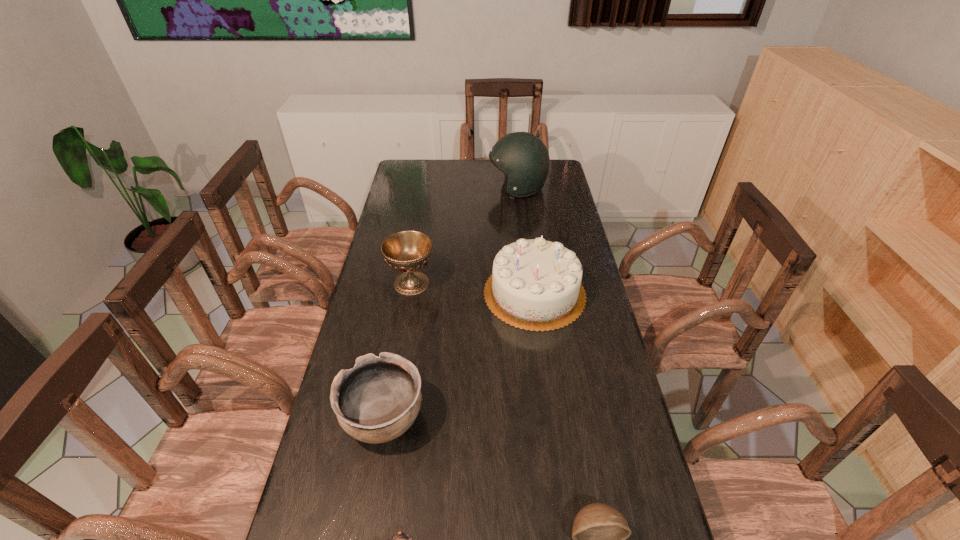
Locate an element on the screen. unoccupied area between the farthest object and the pottery is located at coordinates (451, 303).

The width and height of the screenshot is (960, 540). Find the location of `free space that is in between the pottery and the chalice`. free space that is in between the pottery and the chalice is located at coordinates (397, 351).

Image resolution: width=960 pixels, height=540 pixels. I want to click on free spot between the farthest object and the chalice, so click(465, 236).

This screenshot has height=540, width=960. I want to click on free spot between the birthday cake and the pottery, so click(459, 356).

In order to click on unoccupied area between the pottery and the chalice in this screenshot , I will do click(x=397, y=351).

Point out which object is positioned as the fourth nearest to the kitten. Please provide its 2D coordinates. Your answer should be formatted as a tuple, i.e. [(x, y)], where the tuple contains the x and y coordinates of a point satisfying the conditions above.

[(407, 251)]

Where is `object that stands as the fourth closest to the birthday cake`? The height and width of the screenshot is (540, 960). object that stands as the fourth closest to the birthday cake is located at coordinates (599, 533).

Locate an element on the screen. Image resolution: width=960 pixels, height=540 pixels. vacant region that satisfies the following two spatial constraints: 1. on the back side of the third nearest object; 2. on the left side of the birthday cake is located at coordinates (406, 293).

You are a GUI agent. You are given a task and a screenshot of the screen. Output one action in this format:
    pyautogui.click(x=<x>, y=<y>)
    Task: Click on the vacant area that satisfies the following two spatial constraints: 1. at the face opening of the football helmet; 2. on the front side of the pottery
    The width and height of the screenshot is (960, 540).
    Given the screenshot: What is the action you would take?
    pyautogui.click(x=545, y=418)

The height and width of the screenshot is (540, 960). Find the location of `vacant space that satisfies the following two spatial constraints: 1. at the face opening of the tallest object; 2. on the front side of the fourth farthest object`. vacant space that satisfies the following two spatial constraints: 1. at the face opening of the tallest object; 2. on the front side of the fourth farthest object is located at coordinates (545, 418).